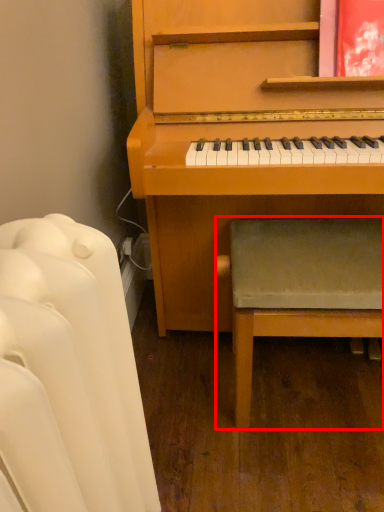
Question: Considering the relative positions of armchair (annotated by the red box) and furniture in the image provided, where is armchair (annotated by the red box) located with respect to the staircase?

Choices:
 (A) left
 (B) right

Answer: (B)